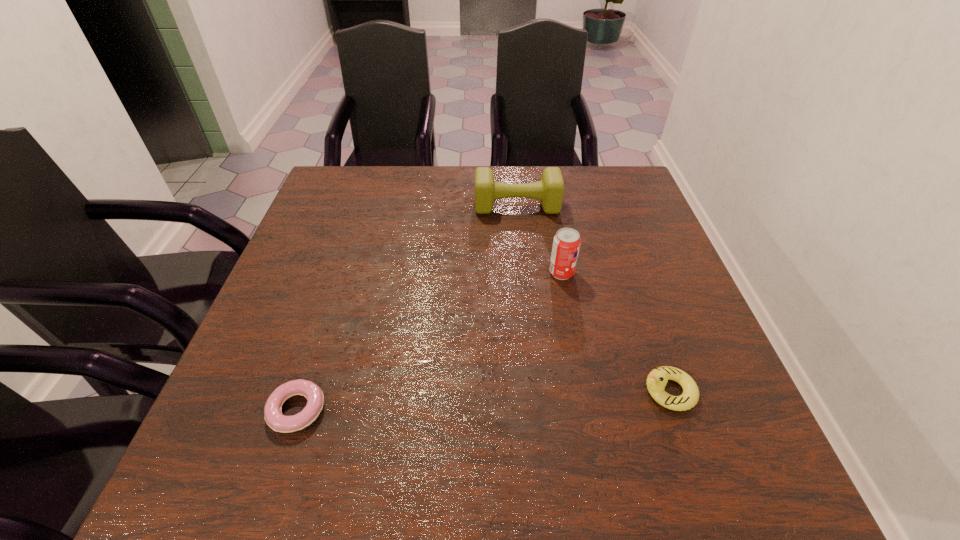
This screenshot has height=540, width=960. I want to click on free point at the far left corner, so click(309, 211).

In the image, there is a desktop. Where is `vacant region at the near left corner`? The image size is (960, 540). vacant region at the near left corner is located at coordinates (258, 500).

Find the location of a particular element. The width and height of the screenshot is (960, 540). vacant space at the far right corner of the desktop is located at coordinates (632, 177).

The width and height of the screenshot is (960, 540). In order to click on vacant space that's between the shortest object and the rightmost object in this screenshot , I will do `click(483, 401)`.

Where is `unoccupied position between the shortest object and the second shortest object`? The height and width of the screenshot is (540, 960). unoccupied position between the shortest object and the second shortest object is located at coordinates (483, 401).

Image resolution: width=960 pixels, height=540 pixels. I want to click on free space between the doughnut and the duckling, so click(483, 401).

Locate an element on the screen. This screenshot has width=960, height=540. unoccupied position between the doughnut and the dumbbell is located at coordinates (407, 308).

Locate an element on the screen. This screenshot has width=960, height=540. free space that is in between the soda can and the shortest object is located at coordinates point(429,341).

The width and height of the screenshot is (960, 540). Find the location of `vacant area between the second shortest object and the second tallest object`. vacant area between the second shortest object and the second tallest object is located at coordinates (593, 299).

The image size is (960, 540). I want to click on free space between the duckling and the leftmost object, so click(x=483, y=401).